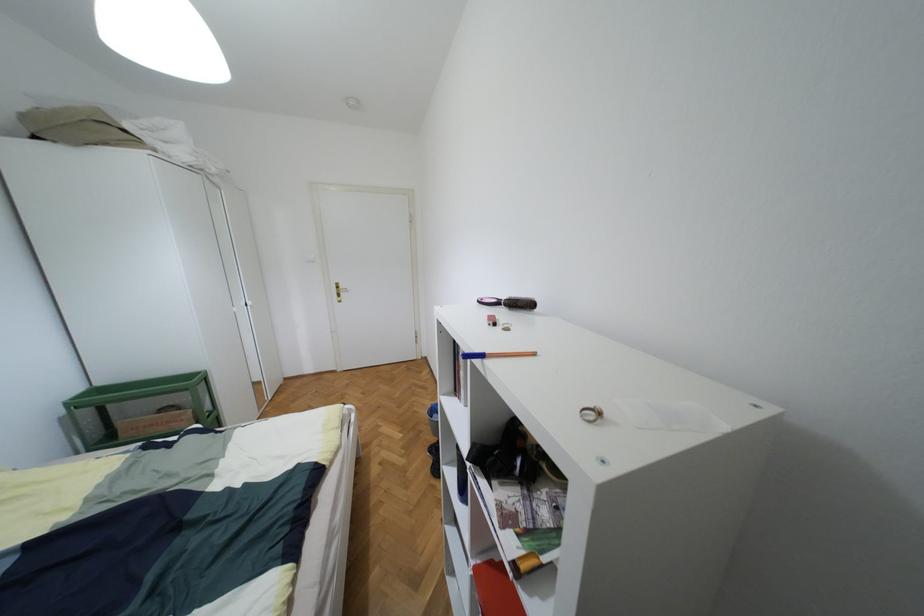
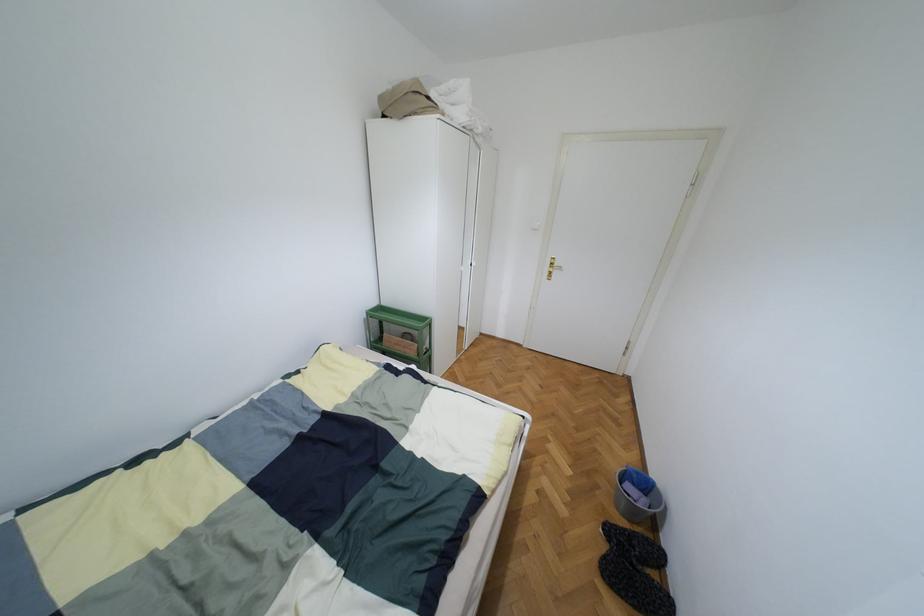
The point at (95, 391) is marked in the first image. Where is the corresponding point in the second image?

(380, 307)